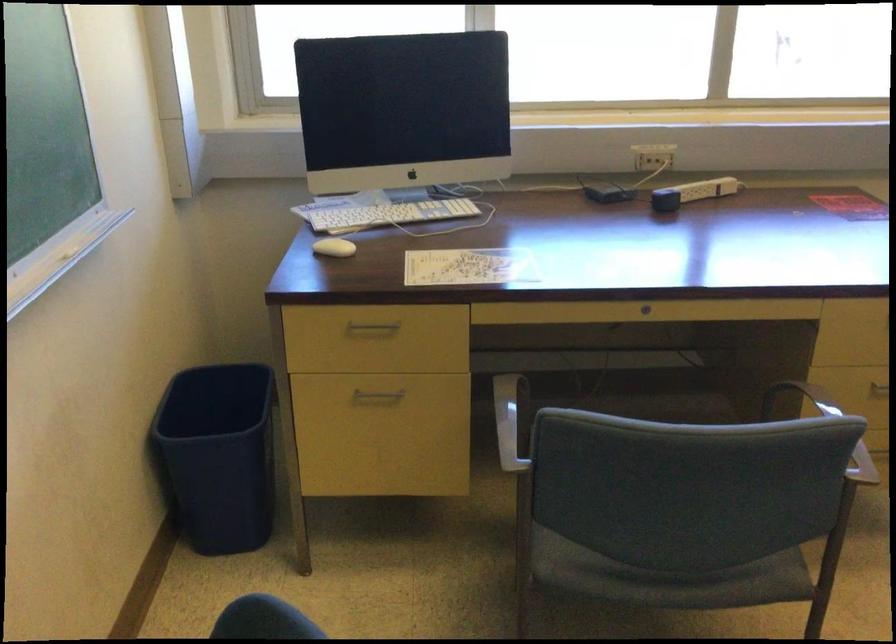
Where is `white computer mouse`? The image size is (896, 644). white computer mouse is located at coordinates (333, 247).